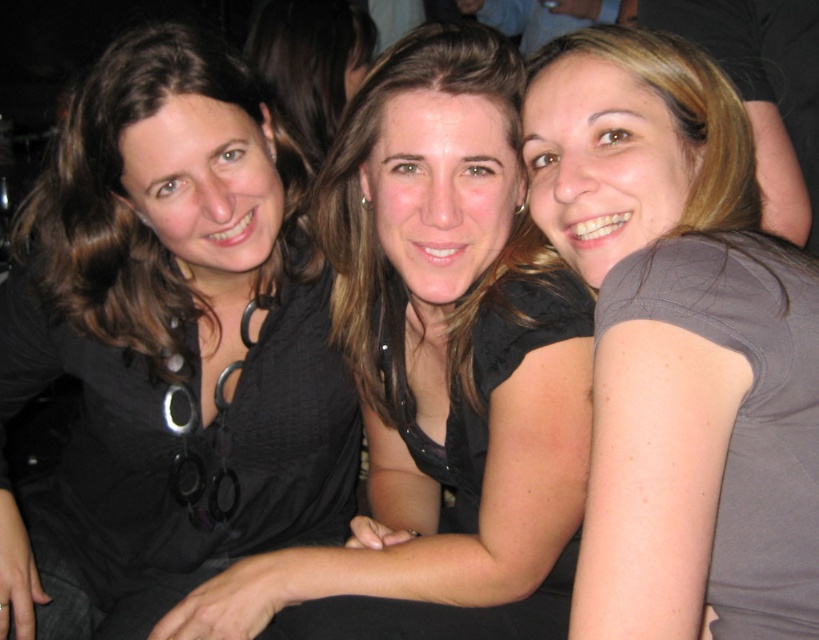
Does black matte/black fabric at left appear under matte gray shirt at right?

Yes.

Who is higher up, black matte/black fabric at left or matte gray shirt at right?

matte gray shirt at right is higher up.

Does point (175, 374) lie in front of point (600, 108)?

No, it is not.

Identify the location of black matte/black fabric at left. This screenshot has width=819, height=640. (168, 342).